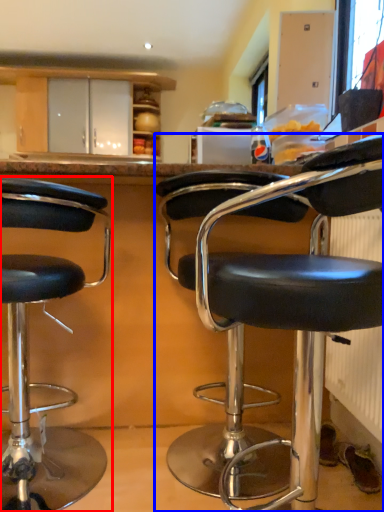
Question: Which point is closer to the camera, chair (highlighted by a red box) or chair (highlighted by a blue box)?

Choices:
 (A) chair
 (B) chair

Answer: (B)